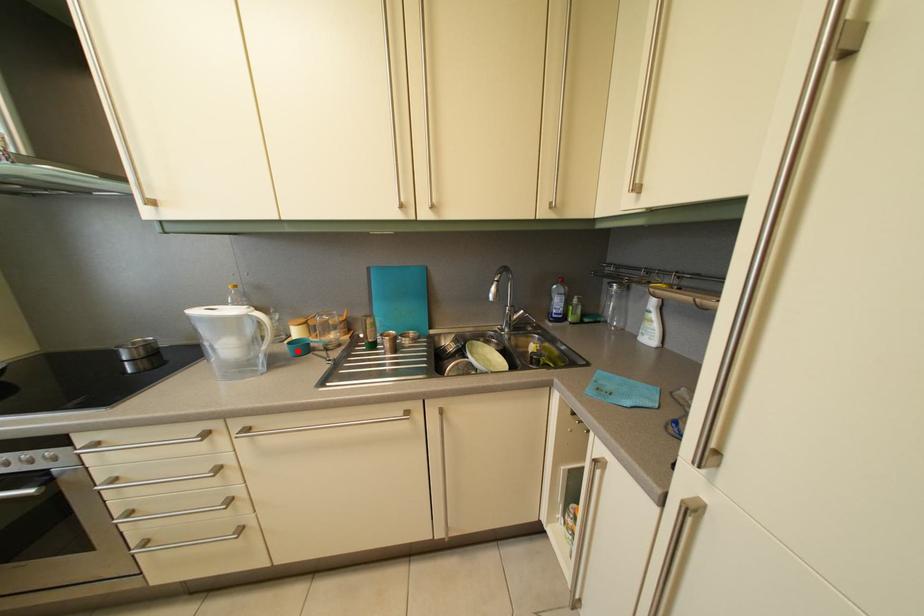
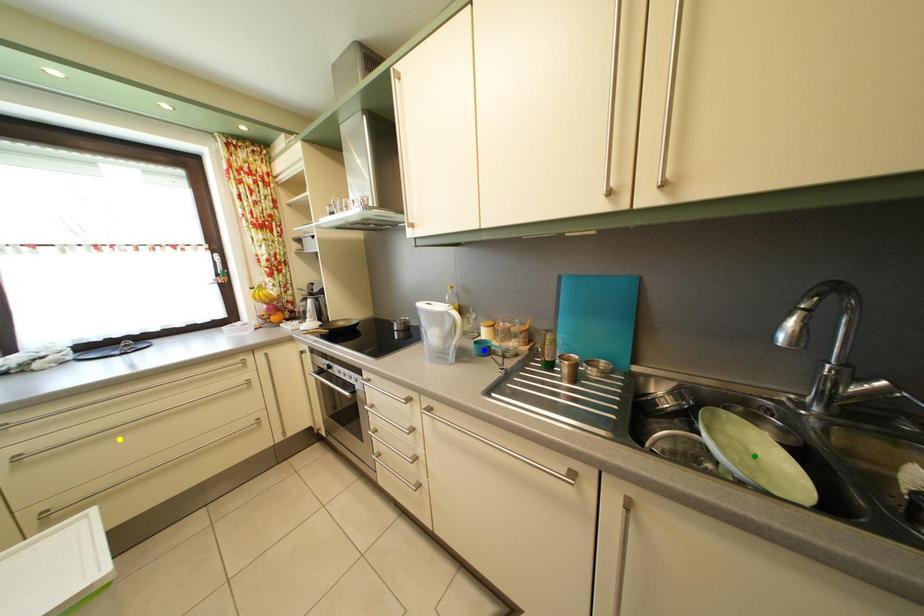
Question: I am providing you with two images of the same scene from different viewpoints. A red point is marked on the first image. You are given multiple points on the second image. Which point in image 2 is actually the same real-world point as the red point in image 1?

Choices:
 (A) yellow point
 (B) green point
 (C) blue point

Answer: (C)